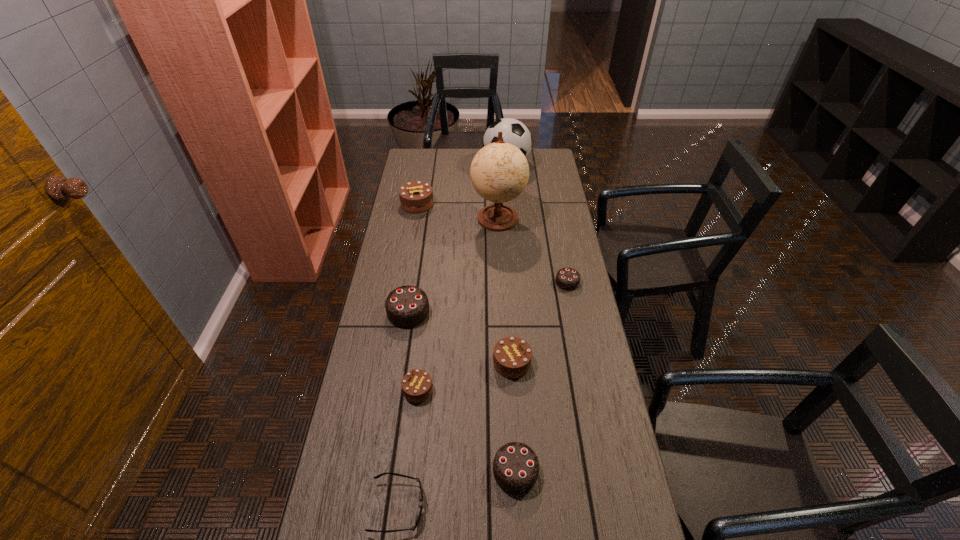
In order to click on the second smallest chocolate chocolate cake in this screenshot , I will do tap(515, 467).

Where is `the smallest brown chocolate cake`? the smallest brown chocolate cake is located at coordinates (416, 385).

Find the location of a particular element. The image size is (960, 540). the rightmost chocolate cake is located at coordinates (568, 279).

Where is `the rightmost chocolate chocolate cake`? the rightmost chocolate chocolate cake is located at coordinates (568, 279).

Where is `the shortest object`? The width and height of the screenshot is (960, 540). the shortest object is located at coordinates (413, 528).

In order to click on black sunglasses in this screenshot , I will do `click(413, 528)`.

I want to click on vacant space located on the surface of the tallest object, so click(500, 262).

Where is `vacant space located on the front of the soccer ball`? The height and width of the screenshot is (540, 960). vacant space located on the front of the soccer ball is located at coordinates (509, 193).

Identify the location of vacant region located on the front of the farthest chocolate cake. The image size is (960, 540). (412, 235).

This screenshot has width=960, height=540. I want to click on blank area located on the back of the third farthest chocolate cake, so click(x=417, y=254).